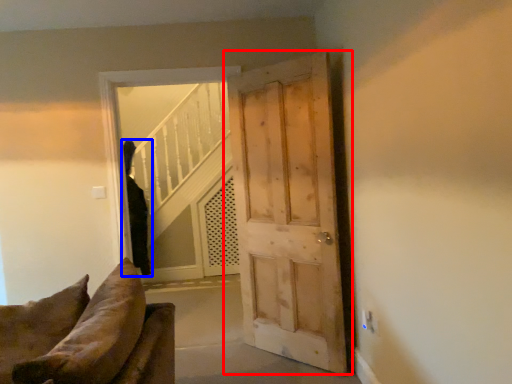
Question: Which point is further to the camera, door (highlighted by a red box) or person (highlighted by a blue box)?

Choices:
 (A) door
 (B) person

Answer: (B)